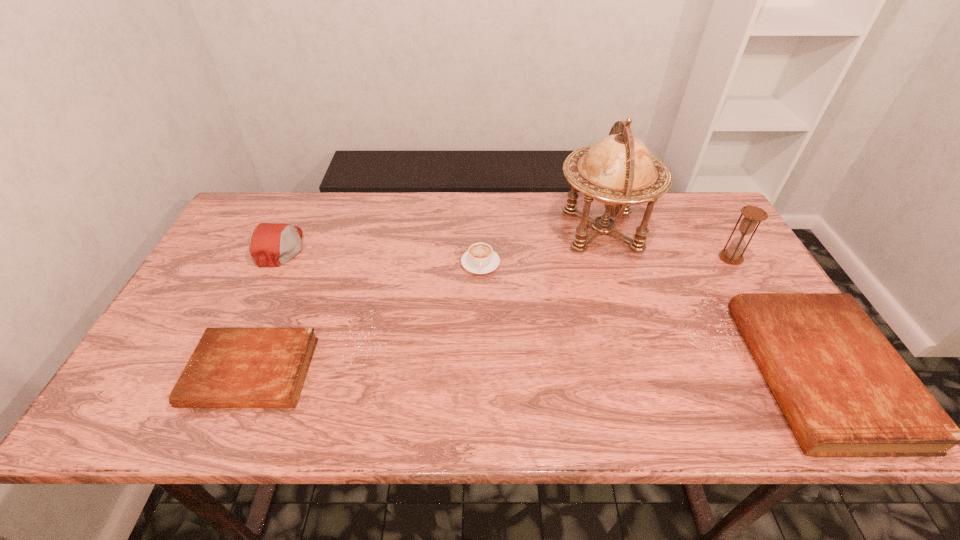
Where is `vacant area located on the spine side of the third shortest object`? vacant area located on the spine side of the third shortest object is located at coordinates (673, 374).

Where is `free space located on the front-facing side of the tallest object`? This screenshot has width=960, height=540. free space located on the front-facing side of the tallest object is located at coordinates (509, 231).

At what (x,y) coordinates should I click in order to perform the action: click on vacant space located 0.300m on the front-facing side of the tallest object. Please return your answer as a coordinate pair (x, y). Looking at the image, I should click on (457, 231).

Where is `vacant region located on the front-facing side of the tallest object`? The width and height of the screenshot is (960, 540). vacant region located on the front-facing side of the tallest object is located at coordinates (476, 231).

The image size is (960, 540). Identify the location of vacant space located on the front of the fifth shortest object. (786, 351).

I want to click on vacant position located 0.350m on the front-facing side of the fourth shortest object, so click(423, 247).

Find the location of a particular element. This screenshot has height=540, width=960. free spot located 0.260m on the side of the cappuccino with the handle is located at coordinates (481, 355).

Find the location of a particular element. This screenshot has width=960, height=540. globe that is at the far edge is located at coordinates (619, 170).

Identify the location of cap that is positioned at the far edge. The image size is (960, 540). (270, 244).

What are the coordinates of `Bible that is at the left edge` in the screenshot? It's located at (230, 367).